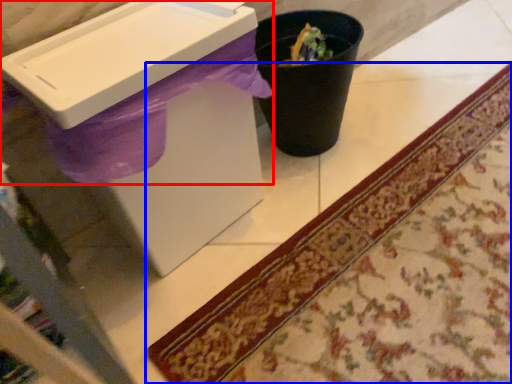
Question: Which object is further to the camera taking this photo, sink (highlighted by a red box) or mat (highlighted by a blue box)?

Choices:
 (A) sink
 (B) mat

Answer: (A)